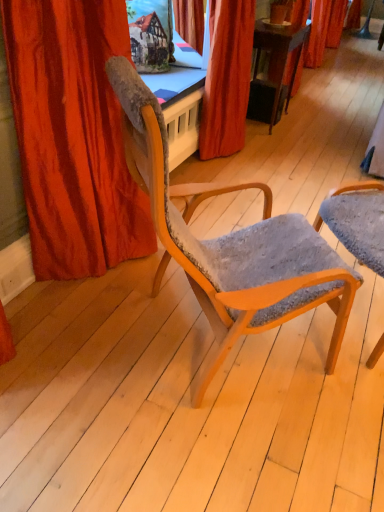
How much space does textured gray fabric chair at center, positioned as the second chair in left-to-right order, occupy horizontally?

textured gray fabric chair at center, positioned as the second chair in left-to-right order, is 18.16 inches in width.

This screenshot has width=384, height=512. I want to click on textured gray fabric chair at center, marked as the first chair in a right-to-left arrangement, so click(357, 221).

You are a GUI agent. You are given a task and a screenshot of the screen. Output one action in this format:
    pyautogui.click(x=<x>, y=<y>)
    Task: Click on the wooden chair with textured fabric at center, the 1th chair in the left-to-right sequence
    This screenshot has width=384, height=512.
    Given the screenshot: What is the action you would take?
    pyautogui.click(x=231, y=242)

Locate an element on the screen. The width and height of the screenshot is (384, 512). textured gray fabric chair at center, marked as the first chair in a right-to-left arrangement is located at coordinates (357, 221).

Where is `the 2nd curtain positioned above the wooden chair with textured fabric at center, the 1th chair in the left-to-right sequence (from the image's perspective)`? The width and height of the screenshot is (384, 512). the 2nd curtain positioned above the wooden chair with textured fabric at center, the 1th chair in the left-to-right sequence (from the image's perspective) is located at coordinates (227, 78).

Is wooden chair with textured fabric at center, arranged as the 2th chair when viewed from the right, far away from velvet red curtain at center, marked as the 1th curtain in a back-to-front arrangement?

wooden chair with textured fabric at center, arranged as the 2th chair when viewed from the right, is far away from velvet red curtain at center, marked as the 1th curtain in a back-to-front arrangement.

Based on the photo, is velvet red curtain at center, the second curtain in the left-to-right sequence, located within wooden chair with textured fabric at center, the 1th chair in the left-to-right sequence?

No, velvet red curtain at center, the second curtain in the left-to-right sequence, is not a part of wooden chair with textured fabric at center, the 1th chair in the left-to-right sequence.

From the image's perspective, would you say wooden chair with textured fabric at center, the 1th chair in the left-to-right sequence, is positioned over velvet red curtain at center, which is the 1th curtain from right to left?

Actually, wooden chair with textured fabric at center, the 1th chair in the left-to-right sequence, appears below velvet red curtain at center, which is the 1th curtain from right to left, in the image.

Can you confirm if velvet orange curtain at left, the first curtain when ordered from front to back, is thinner than velvet red curtain at center, marked as the 1th curtain in a back-to-front arrangement?

In fact, velvet orange curtain at left, the first curtain when ordered from front to back, might be wider than velvet red curtain at center, marked as the 1th curtain in a back-to-front arrangement.

Which object is further away from the camera taking this photo, velvet orange curtain at left, acting as the 2th curtain starting from the right, or velvet red curtain at center, the second curtain in the left-to-right sequence?

velvet red curtain at center, the second curtain in the left-to-right sequence, is further away from the camera.

Can we say velvet orange curtain at left, the first curtain when ordered from front to back, lies outside velvet red curtain at center, which is the 2th curtain in front-to-back order?

velvet orange curtain at left, the first curtain when ordered from front to back, lies outside velvet red curtain at center, which is the 2th curtain in front-to-back order,'s area.

Is velvet orange curtain at left, acting as the 2th curtain starting from the right, positioned with its back to velvet red curtain at center, which is the 1th curtain from right to left?

No, velvet red curtain at center, which is the 1th curtain from right to left, is not at the back of velvet orange curtain at left, acting as the 2th curtain starting from the right.

Which of these two, textured gray fabric chair at center, positioned as the second chair in left-to-right order, or velvet orange curtain at left, acting as the 2th curtain starting from the right, is thinner?

With smaller width is velvet orange curtain at left, acting as the 2th curtain starting from the right.

From a real-world perspective, is textured gray fabric chair at center, marked as the first chair in a right-to-left arrangement, physically located above or below velvet orange curtain at left, acting as the 2th curtain starting from the right?

From a real-world perspective, textured gray fabric chair at center, marked as the first chair in a right-to-left arrangement, is physically below velvet orange curtain at left, acting as the 2th curtain starting from the right.

Looking at this image, how much distance is there between textured gray fabric chair at center, positioned as the second chair in left-to-right order, and velvet orange curtain at left, which is the 1th curtain from left to right?

They are 3.32 feet apart.

Which is closer to the camera, (246, 56) or (147, 137)?

Point (246, 56).

Between velvet red curtain at center, which is the 2th curtain in front-to-back order, and wooden chair with textured fabric at center, arranged as the 2th chair when viewed from the right, which one has less height?

velvet red curtain at center, which is the 2th curtain in front-to-back order, is shorter.

Is velvet red curtain at center, which is the 2th curtain in front-to-back order, spatially inside wooden chair with textured fabric at center, the 1th chair in the left-to-right sequence, or outside of it?

velvet red curtain at center, which is the 2th curtain in front-to-back order, exists outside the volume of wooden chair with textured fabric at center, the 1th chair in the left-to-right sequence.

What are the coordinates of `chair located on the left of velvet red curtain at center, which is the 2th curtain in front-to-back order` in the screenshot? It's located at (231, 242).

Is velvet orange curtain at left, the second curtain when ordered from back to front, turned away from wooden chair with textured fabric at center, the 1th chair in the left-to-right sequence?

That's not correct — velvet orange curtain at left, the second curtain when ordered from back to front, is not looking away from wooden chair with textured fabric at center, the 1th chair in the left-to-right sequence.

From a real-world perspective, is velvet orange curtain at left, the first curtain when ordered from front to back, above or below wooden chair with textured fabric at center, the 1th chair in the left-to-right sequence?

From a real-world perspective, velvet orange curtain at left, the first curtain when ordered from front to back, is physically above wooden chair with textured fabric at center, the 1th chair in the left-to-right sequence.

Considering the sizes of objects velvet orange curtain at left, acting as the 2th curtain starting from the right, and wooden chair with textured fabric at center, arranged as the 2th chair when viewed from the right, in the image provided, who is wider, velvet orange curtain at left, acting as the 2th curtain starting from the right, or wooden chair with textured fabric at center, arranged as the 2th chair when viewed from the right,?

With larger width is wooden chair with textured fabric at center, arranged as the 2th chair when viewed from the right.

Does velvet orange curtain at left, the first curtain when ordered from front to back, have a greater height compared to wooden chair with textured fabric at center, arranged as the 2th chair when viewed from the right?

Yes, velvet orange curtain at left, the first curtain when ordered from front to back, is taller than wooden chair with textured fabric at center, arranged as the 2th chair when viewed from the right.

Does velvet orange curtain at left, the second curtain when ordered from back to front, turn towards textured gray fabric chair at center, marked as the first chair in a right-to-left arrangement?

Yes, velvet orange curtain at left, the second curtain when ordered from back to front, is aimed at textured gray fabric chair at center, marked as the first chair in a right-to-left arrangement.

Can you tell me how much velvet orange curtain at left, acting as the 2th curtain starting from the right, and textured gray fabric chair at center, marked as the first chair in a right-to-left arrangement, differ in facing direction?

The facing directions of velvet orange curtain at left, acting as the 2th curtain starting from the right, and textured gray fabric chair at center, marked as the first chair in a right-to-left arrangement, are 42.1 degrees apart.

From the image's perspective, is velvet orange curtain at left, acting as the 2th curtain starting from the right, above or below textured gray fabric chair at center, positioned as the second chair in left-to-right order?

Based on their image positions, velvet orange curtain at left, acting as the 2th curtain starting from the right, is located above textured gray fabric chair at center, positioned as the second chair in left-to-right order.

Is point (105, 106) closer to viewer compared to point (330, 211)?

Yes.

Is textured gray fabric chair at center, positioned as the second chair in left-to-right order, aimed at velvet red curtain at center, which is the 1th curtain from right to left?

No.

Is velvet red curtain at center, which is the 1th curtain from right to left, completely or partially inside textured gray fabric chair at center, marked as the first chair in a right-to-left arrangement?

Actually, velvet red curtain at center, which is the 1th curtain from right to left, is outside textured gray fabric chair at center, marked as the first chair in a right-to-left arrangement.

Can you confirm if textured gray fabric chair at center, marked as the first chair in a right-to-left arrangement, is shorter than velvet red curtain at center, which is the 1th curtain from right to left?

Indeed, textured gray fabric chair at center, marked as the first chair in a right-to-left arrangement, has a lesser height compared to velvet red curtain at center, which is the 1th curtain from right to left.

Is textured gray fabric chair at center, marked as the first chair in a right-to-left arrangement, positioned far away from velvet red curtain at center, the second curtain in the left-to-right sequence?

textured gray fabric chair at center, marked as the first chair in a right-to-left arrangement, is far away from velvet red curtain at center, the second curtain in the left-to-right sequence.

Where is `chair that is the 2nd one when counting forward from the velvet red curtain at center, which is the 2th curtain in front-to-back order`? Image resolution: width=384 pixels, height=512 pixels. chair that is the 2nd one when counting forward from the velvet red curtain at center, which is the 2th curtain in front-to-back order is located at coordinates (231, 242).

The width and height of the screenshot is (384, 512). Identify the location of curtain below the velvet red curtain at center, which is the 1th curtain from right to left (from the image's perspective). (73, 136).

Estimate the real-world distances between objects in this image. Which object is further from velvet red curtain at center, which is the 2th curtain in front-to-back order, textured gray fabric chair at center, marked as the first chair in a right-to-left arrangement, or velvet orange curtain at left, the first curtain when ordered from front to back?

velvet orange curtain at left, the first curtain when ordered from front to back, is positioned further to the anchor velvet red curtain at center, which is the 2th curtain in front-to-back order.

Based on their spatial positions, is velvet orange curtain at left, the first curtain when ordered from front to back, or wooden chair with textured fabric at center, arranged as the 2th chair when viewed from the right, closer to textured gray fabric chair at center, positioned as the second chair in left-to-right order?

Among the two, wooden chair with textured fabric at center, arranged as the 2th chair when viewed from the right, is located nearer to textured gray fabric chair at center, positioned as the second chair in left-to-right order.

From the image, which object appears to be farther from velvet red curtain at center, the second curtain in the left-to-right sequence, textured gray fabric chair at center, marked as the first chair in a right-to-left arrangement, or wooden chair with textured fabric at center, the 1th chair in the left-to-right sequence?

wooden chair with textured fabric at center, the 1th chair in the left-to-right sequence.

Considering their positions, is wooden chair with textured fabric at center, the 1th chair in the left-to-right sequence, positioned closer to textured gray fabric chair at center, positioned as the second chair in left-to-right order, than velvet red curtain at center, marked as the 1th curtain in a back-to-front arrangement?

The object closer to textured gray fabric chair at center, positioned as the second chair in left-to-right order, is wooden chair with textured fabric at center, the 1th chair in the left-to-right sequence.

Which object lies further to the anchor point velvet orange curtain at left, acting as the 2th curtain starting from the right, velvet red curtain at center, which is the 1th curtain from right to left, or wooden chair with textured fabric at center, arranged as the 2th chair when viewed from the right?

Among the two, velvet red curtain at center, which is the 1th curtain from right to left, is located further to velvet orange curtain at left, acting as the 2th curtain starting from the right.

Which object lies further to the anchor point velvet orange curtain at left, acting as the 2th curtain starting from the right, textured gray fabric chair at center, positioned as the second chair in left-to-right order, or velvet red curtain at center, which is the 1th curtain from right to left?

Based on the image, velvet red curtain at center, which is the 1th curtain from right to left, appears to be further to velvet orange curtain at left, acting as the 2th curtain starting from the right.

Estimate the real-world distances between objects in this image. Which object is further from wooden chair with textured fabric at center, the 1th chair in the left-to-right sequence, velvet red curtain at center, marked as the 1th curtain in a back-to-front arrangement, or velvet orange curtain at left, the second curtain when ordered from back to front?

velvet red curtain at center, marked as the 1th curtain in a back-to-front arrangement, lies further to wooden chair with textured fabric at center, the 1th chair in the left-to-right sequence, than the other object.

Which object lies further to the anchor point velvet red curtain at center, the second curtain in the left-to-right sequence, velvet orange curtain at left, the second curtain when ordered from back to front, or wooden chair with textured fabric at center, arranged as the 2th chair when viewed from the right?

wooden chair with textured fabric at center, arranged as the 2th chair when viewed from the right.

Identify the location of chair between velvet orange curtain at left, which is the 1th curtain from left to right, and textured gray fabric chair at center, positioned as the second chair in left-to-right order, from left to right. This screenshot has height=512, width=384. coord(231,242).

You are a GUI agent. You are given a task and a screenshot of the screen. Output one action in this format:
    pyautogui.click(x=<x>, y=<y>)
    Task: Click on the curtain between velvet red curtain at center, which is the 1th curtain from right to left, and textured gray fabric chair at center, positioned as the second chair in left-to-right order, from top to bottom
    This screenshot has width=384, height=512.
    Given the screenshot: What is the action you would take?
    pyautogui.click(x=73, y=136)

Locate an element on the screen. curtain located between wooden chair with textured fabric at center, the 1th chair in the left-to-right sequence, and velvet red curtain at center, which is the 2th curtain in front-to-back order, in the depth direction is located at coordinates (73, 136).

The image size is (384, 512). I want to click on chair between wooden chair with textured fabric at center, arranged as the 2th chair when viewed from the right, and velvet red curtain at center, marked as the 1th curtain in a back-to-front arrangement, from front to back, so click(357, 221).